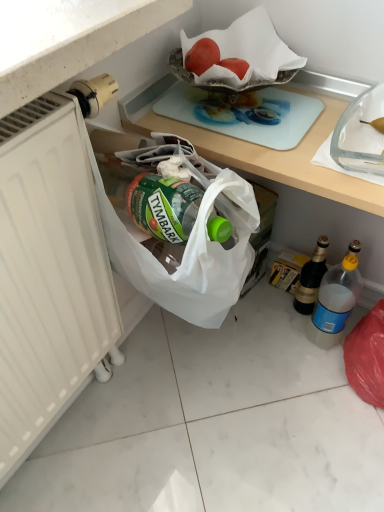
Question: Can you confirm if blue plastic bottle at lower right, the first bottle viewed from the front, is positioned to the right of dark brown glass bottle at lower right, which is the second bottle in front-to-back order?

Choices:
 (A) yes
 (B) no

Answer: (A)

Question: Is the depth of blue plastic bottle at lower right, acting as the 2th bottle starting from the back, less than that of dark brown glass bottle at lower right, the first bottle positioned from the back?

Choices:
 (A) no
 (B) yes

Answer: (B)

Question: Is blue plastic bottle at lower right, the first bottle viewed from the front, not near dark brown glass bottle at lower right, which is the second bottle in front-to-back order?

Choices:
 (A) yes
 (B) no

Answer: (B)

Question: From a real-world perspective, is blue plastic bottle at lower right, acting as the 2th bottle starting from the back, positioned under dark brown glass bottle at lower right, which is the second bottle in front-to-back order, based on gravity?

Choices:
 (A) yes
 (B) no

Answer: (B)

Question: Is blue plastic bottle at lower right, the first bottle viewed from the front, smaller than dark brown glass bottle at lower right, the first bottle positioned from the back?

Choices:
 (A) no
 (B) yes

Answer: (A)

Question: Can you confirm if blue plastic bottle at lower right, acting as the 2th bottle starting from the back, is thinner than dark brown glass bottle at lower right, which is the second bottle in front-to-back order?

Choices:
 (A) yes
 (B) no

Answer: (B)

Question: Considering the relative positions of blue plastic bottle at lower right, acting as the 2th bottle starting from the back, and white matte tile at lower left in the image provided, is blue plastic bottle at lower right, acting as the 2th bottle starting from the back, to the left of white matte tile at lower left from the viewer's perspective?

Choices:
 (A) no
 (B) yes

Answer: (A)

Question: Considering the relative sizes of blue plastic bottle at lower right, acting as the 2th bottle starting from the back, and white matte tile at lower left in the image provided, is blue plastic bottle at lower right, acting as the 2th bottle starting from the back, taller than white matte tile at lower left?

Choices:
 (A) no
 (B) yes

Answer: (B)

Question: Is blue plastic bottle at lower right, the first bottle viewed from the front, further to camera compared to white matte tile at lower left?

Choices:
 (A) yes
 (B) no

Answer: (A)

Question: From the image's perspective, is blue plastic bottle at lower right, acting as the 2th bottle starting from the back, over white matte tile at lower left?

Choices:
 (A) no
 (B) yes

Answer: (B)

Question: From the image's perspective, does blue plastic bottle at lower right, the first bottle viewed from the front, appear lower than white matte tile at lower left?

Choices:
 (A) no
 (B) yes

Answer: (A)

Question: Is blue plastic bottle at lower right, the first bottle viewed from the front, looking in the opposite direction of white matte tile at lower left?

Choices:
 (A) no
 (B) yes

Answer: (A)

Question: Is the depth of white matte radiator at left greater than that of red matte tomato at upper center?

Choices:
 (A) yes
 (B) no

Answer: (B)